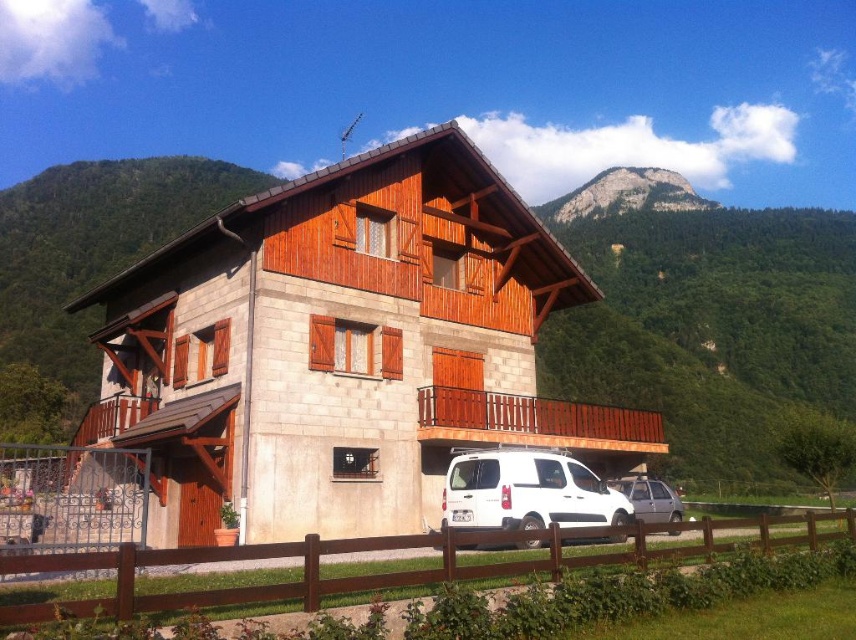
Question: Where is white matte van at lower center located in relation to rugged stone mountain at upper center in the image?

Choices:
 (A) right
 (B) left

Answer: (B)

Question: Estimate the real-world distances between objects in this image. Which object is farther from the brown wooden fence at lower center?

Choices:
 (A) wooden chalet at center
 (B) white matte van at lower center
 (C) silver metallic car at lower center
 (D) rugged stone mountain at upper center

Answer: (D)

Question: Can you confirm if wooden chalet at center is positioned above white matte van at lower center?

Choices:
 (A) no
 (B) yes

Answer: (B)

Question: Which point is farther from the camera taking this photo?

Choices:
 (A) (378, 577)
 (B) (563, 480)
 (C) (317, 253)
 (D) (615, 166)

Answer: (D)

Question: Which of the following is the closest to the observer?

Choices:
 (A) brown wooden fence at lower center
 (B) white matte van at lower center
 (C) silver metallic car at lower center
 (D) rugged stone mountain at upper center

Answer: (A)

Question: Is wooden chalet at center wider than silver metallic car at lower center?

Choices:
 (A) yes
 (B) no

Answer: (A)